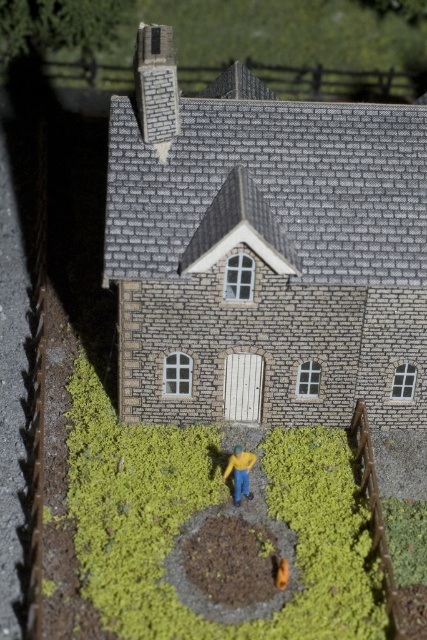
You are a model train enthusiast who wants to place a new miniature figure between the yellow matte jacket at center and the orange matte toy at center in the model house scene. The figure requires 10 inches of space to fit comfortably. Can you place the figure between them?

The yellow matte jacket at center and orange matte toy at center are 9.69 inches apart, which is less than the required 10 inches. Therefore, the figure cannot be placed between them comfortably.

You are a child playing with the miniature house. You see the yellow matte jacket at center and the orange matte toy at center. Which object is placed higher in the scene?

The yellow matte jacket at center is positioned over the orange matte toy at center, so it is placed higher.